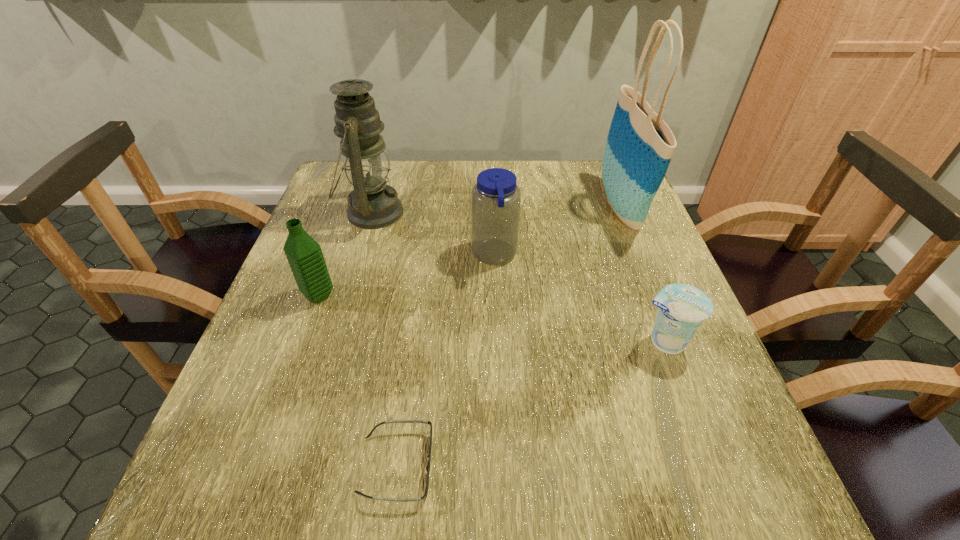
Identify the location of the tallest object. This screenshot has width=960, height=540. (639, 147).

You are a GUI agent. You are given a task and a screenshot of the screen. Output one action in this format:
    pyautogui.click(x=<x>, y=<y>)
    Task: Click on the oil lamp
    The image size is (960, 540).
    Given the screenshot: What is the action you would take?
    pyautogui.click(x=372, y=204)

In order to click on the fourth object from left to right in this screenshot , I will do click(x=496, y=198).

Where is `the right water bottle`? The width and height of the screenshot is (960, 540). the right water bottle is located at coordinates (496, 198).

The height and width of the screenshot is (540, 960). I want to click on the nearer water bottle, so click(304, 255).

Locate an element on the screen. The width and height of the screenshot is (960, 540). the fourth farthest object is located at coordinates (304, 255).

Image resolution: width=960 pixels, height=540 pixels. What are the coordinates of `the second nearest object` in the screenshot? It's located at (682, 308).

The width and height of the screenshot is (960, 540). In order to click on the fifth tallest object in this screenshot , I will do `click(682, 308)`.

Locate an element on the screen. The width and height of the screenshot is (960, 540). sunglasses is located at coordinates (393, 421).

This screenshot has height=540, width=960. I want to click on the third object from left to right, so click(x=393, y=421).